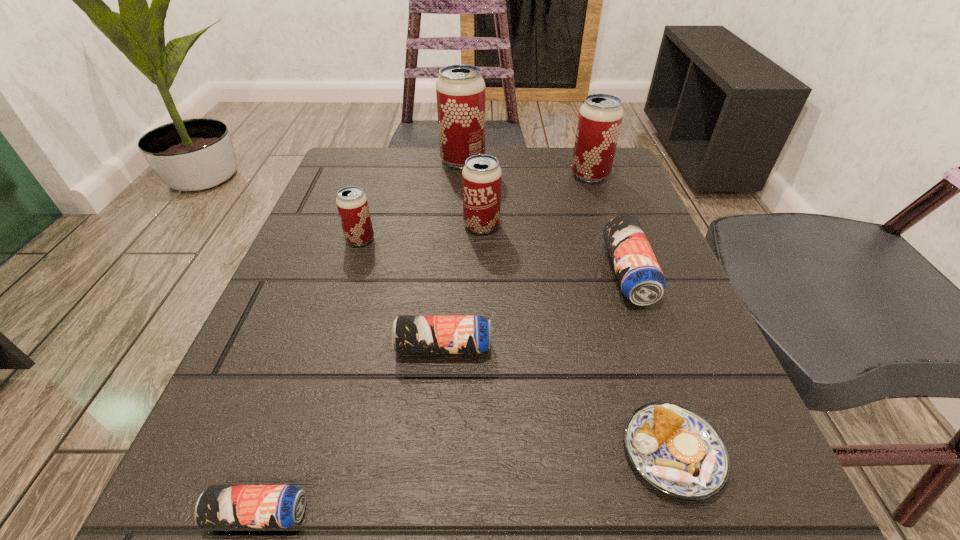
The height and width of the screenshot is (540, 960). I want to click on vacant space situated on the right of the third nearest object, so click(702, 347).

What are the coordinates of `free spot located 0.060m on the back of the brown pastry` in the screenshot? It's located at pyautogui.click(x=645, y=369).

You are a GUI agent. You are given a task and a screenshot of the screen. Output one action in this format:
    pyautogui.click(x=<x>, y=<y>)
    Task: Click on the free location located on the right of the nearest blue beer can
    Image resolution: width=960 pixels, height=540 pixels.
    Given the screenshot: What is the action you would take?
    pyautogui.click(x=515, y=514)

Where is `pastry present at the near edge`? pastry present at the near edge is located at coordinates (677, 451).

The width and height of the screenshot is (960, 540). What are the coordinates of `beer can located at the near edge` in the screenshot? It's located at (220, 506).

Locate an element on the screen. pastry positioned at the right edge is located at coordinates (677, 451).

This screenshot has width=960, height=540. In order to click on object situated at the near left corner in this screenshot , I will do `click(220, 506)`.

Identify the location of object at the far right corner. The width and height of the screenshot is (960, 540). (600, 117).

Where is `object that is at the near right corner`? This screenshot has height=540, width=960. object that is at the near right corner is located at coordinates (677, 451).

I want to click on vacant space at the near edge of the desktop, so click(599, 516).